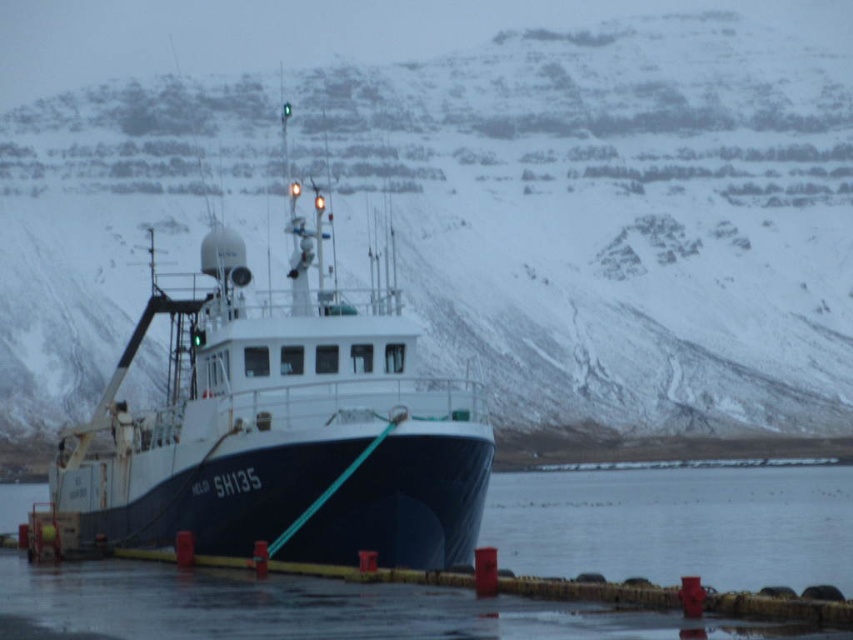
Is snowy rock formation at upper center smaller than black rubber water at lower center?

No, snowy rock formation at upper center is not smaller than black rubber water at lower center.

Who is positioned more to the left, snowy rock formation at upper center or black rubber water at lower center?

black rubber water at lower center

The height and width of the screenshot is (640, 853). In order to click on snowy rock formation at upper center in this screenshot , I will do `click(456, 196)`.

Measure the distance from snowy rock formation at upper center to dark blue matte boat at center.

23.46 meters

Looking at this image, who is shorter, snowy rock formation at upper center or dark blue matte boat at center?

With less height is dark blue matte boat at center.

Is point (550, 24) positioned after point (192, 374)?

Yes, it is behind point (192, 374).

The height and width of the screenshot is (640, 853). Identify the location of snowy rock formation at upper center. (456, 196).

Measure the distance between dark blue matte boat at center and black rubber water at lower center.

dark blue matte boat at center and black rubber water at lower center are 16.10 meters apart from each other.

Is dark blue matte boat at center positioned behind black rubber water at lower center?

Yes, it is.

I want to click on dark blue matte boat at center, so click(283, 424).